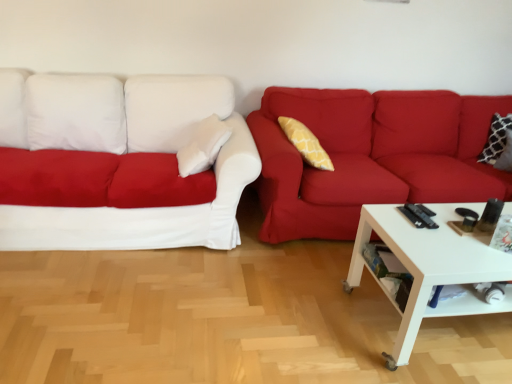
At what (x,y) coordinates should I click in order to perform the action: click on matte red couch at right, which is counted as the second studio couch, starting from the left. Please return your answer as a coordinate pair (x, y). The height and width of the screenshot is (384, 512). Looking at the image, I should click on (371, 156).

Where is `white glossy coffee table at lower right`? This screenshot has width=512, height=384. white glossy coffee table at lower right is located at coordinates (430, 267).

Locate an element on the screen. This screenshot has width=512, height=384. white fabric couch at left, placed as the 2th studio couch when sorted from right to left is located at coordinates (120, 162).

Considering the positions of point (501, 186) and point (257, 154), is point (501, 186) closer or farther from the camera than point (257, 154)?

Point (501, 186) appears to be farther away from the viewer than point (257, 154).

Is matte red couch at right, which is counted as the second studio couch, starting from the left, positioned in front of white fabric couch at left, placed as the 2th studio couch when sorted from right to left?

No, it is behind white fabric couch at left, placed as the 2th studio couch when sorted from right to left.

Based on the photo, from a real-world perspective, who is located lower, matte red couch at right, which is counted as the second studio couch, starting from the left, or white fabric couch at left, the first studio couch when ordered from left to right?

matte red couch at right, which is counted as the second studio couch, starting from the left.

Is matte red couch at right, placed as the 1th studio couch when sorted from right to left, at the left side of white fabric couch at left, placed as the 2th studio couch when sorted from right to left?

No, matte red couch at right, placed as the 1th studio couch when sorted from right to left, is not to the left of white fabric couch at left, placed as the 2th studio couch when sorted from right to left.

From a real-world perspective, which object rests below the other?

white glossy coffee table at lower right is physically lower.

From the image's perspective, would you say white glossy coffee table at lower right is positioned over white fabric couch at left, placed as the 2th studio couch when sorted from right to left?

Actually, white glossy coffee table at lower right appears below white fabric couch at left, placed as the 2th studio couch when sorted from right to left, in the image.

In order to click on coffee table lying below the white fabric couch at left, the first studio couch when ordered from left to right (from the image's perspective) in this screenshot , I will do `click(430, 267)`.

From the picture: Considering the relative sizes of white glossy coffee table at lower right and white fabric couch at left, the first studio couch when ordered from left to right, in the image provided, is white glossy coffee table at lower right wider than white fabric couch at left, the first studio couch when ordered from left to right,?

Correct, the width of white glossy coffee table at lower right exceeds that of white fabric couch at left, the first studio couch when ordered from left to right.

Between white fabric couch at left, the first studio couch when ordered from left to right, and matte red couch at right, which is counted as the second studio couch, starting from the left, which one is positioned in front?

white fabric couch at left, the first studio couch when ordered from left to right.

From a real-world perspective, between white fabric couch at left, placed as the 2th studio couch when sorted from right to left, and matte red couch at right, placed as the 1th studio couch when sorted from right to left, who is vertically higher?

white fabric couch at left, placed as the 2th studio couch when sorted from right to left.

From the image's perspective, which is below, white fabric couch at left, the first studio couch when ordered from left to right, or matte red couch at right, which is counted as the second studio couch, starting from the left?

matte red couch at right, which is counted as the second studio couch, starting from the left, appears lower in the image.

In terms of height, does white fabric couch at left, placed as the 2th studio couch when sorted from right to left, look taller or shorter compared to matte red couch at right, which is counted as the second studio couch, starting from the left?

Clearly, white fabric couch at left, placed as the 2th studio couch when sorted from right to left, is taller compared to matte red couch at right, which is counted as the second studio couch, starting from the left.

From a real-world perspective, which is physically below, white glossy coffee table at lower right or matte red couch at right, placed as the 1th studio couch when sorted from right to left?

white glossy coffee table at lower right is physically lower.

Is white glossy coffee table at lower right located outside matte red couch at right, placed as the 1th studio couch when sorted from right to left?

Indeed, white glossy coffee table at lower right is completely outside matte red couch at right, placed as the 1th studio couch when sorted from right to left.

The image size is (512, 384). What are the coordinates of `the 1st studio couch to the left of the white glossy coffee table at lower right, counting from the anchor's position` in the screenshot? It's located at (371, 156).

In terms of height, does white glossy coffee table at lower right look taller or shorter compared to matte red couch at right, which is counted as the second studio couch, starting from the left?

In the image, white glossy coffee table at lower right appears to be shorter than matte red couch at right, which is counted as the second studio couch, starting from the left.

Is there a large distance between white fabric couch at left, the first studio couch when ordered from left to right, and white glossy coffee table at lower right?

Yes.

From a real-world perspective, who is located higher, white fabric couch at left, the first studio couch when ordered from left to right, or white glossy coffee table at lower right?

white fabric couch at left, the first studio couch when ordered from left to right, is physically above.

Is the depth of white fabric couch at left, placed as the 2th studio couch when sorted from right to left, less than that of white glossy coffee table at lower right?

No, white fabric couch at left, placed as the 2th studio couch when sorted from right to left, is further to the viewer.

What are the coordinates of `the 2nd studio couch directly above the white glossy coffee table at lower right (from a real-world perspective)` in the screenshot? It's located at (120, 162).

From a real-world perspective, is matte red couch at right, which is counted as the second studio couch, starting from the left, physically located above or below white glossy coffee table at lower right?

Clearly, from a real-world perspective, matte red couch at right, which is counted as the second studio couch, starting from the left, is above white glossy coffee table at lower right.

Is there a large distance between matte red couch at right, which is counted as the second studio couch, starting from the left, and white glossy coffee table at lower right?

No, matte red couch at right, which is counted as the second studio couch, starting from the left, is not far away from white glossy coffee table at lower right.

Is matte red couch at right, placed as the 1th studio couch when sorted from right to left, outside of white glossy coffee table at lower right?

matte red couch at right, placed as the 1th studio couch when sorted from right to left, lies outside white glossy coffee table at lower right's area.

Is point (333, 124) behind point (416, 285)?

Yes, point (333, 124) is farther from viewer.

At what (x,y) coordinates should I click in order to perform the action: click on studio couch behind the white fabric couch at left, the first studio couch when ordered from left to right. Please return your answer as a coordinate pair (x, y). The image size is (512, 384). Looking at the image, I should click on (371, 156).

At what (x,y) coordinates should I click in order to perform the action: click on coffee table on the right side of white fabric couch at left, the first studio couch when ordered from left to right. Please return your answer as a coordinate pair (x, y). Looking at the image, I should click on (430, 267).

Estimate the real-world distances between objects in this image. Which object is further from white glossy coffee table at lower right, matte red couch at right, which is counted as the second studio couch, starting from the left, or white fabric couch at left, the first studio couch when ordered from left to right?

white fabric couch at left, the first studio couch when ordered from left to right.

Estimate the real-world distances between objects in this image. Which object is closer to white fabric couch at left, the first studio couch when ordered from left to right, matte red couch at right, which is counted as the second studio couch, starting from the left, or white glossy coffee table at lower right?

The object closer to white fabric couch at left, the first studio couch when ordered from left to right, is matte red couch at right, which is counted as the second studio couch, starting from the left.

Which object lies nearer to the anchor point white glossy coffee table at lower right, white fabric couch at left, the first studio couch when ordered from left to right, or matte red couch at right, placed as the 1th studio couch when sorted from right to left?

matte red couch at right, placed as the 1th studio couch when sorted from right to left, is positioned closer to the anchor white glossy coffee table at lower right.

Looking at this image, when comparing their distances from white fabric couch at left, the first studio couch when ordered from left to right, does white glossy coffee table at lower right or matte red couch at right, which is counted as the second studio couch, starting from the left, seem further?

Among the two, white glossy coffee table at lower right is located further to white fabric couch at left, the first studio couch when ordered from left to right.

Considering their positions, is white glossy coffee table at lower right positioned closer to matte red couch at right, placed as the 1th studio couch when sorted from right to left, than white fabric couch at left, placed as the 2th studio couch when sorted from right to left?

white glossy coffee table at lower right.

Estimate the real-world distances between objects in this image. Which object is closer to matte red couch at right, placed as the 1th studio couch when sorted from right to left, white fabric couch at left, placed as the 2th studio couch when sorted from right to left, or white glossy coffee table at lower right?

The object closer to matte red couch at right, placed as the 1th studio couch when sorted from right to left, is white glossy coffee table at lower right.

Where is `studio couch between white fabric couch at left, the first studio couch when ordered from left to right, and white glossy coffee table at lower right`? The height and width of the screenshot is (384, 512). studio couch between white fabric couch at left, the first studio couch when ordered from left to right, and white glossy coffee table at lower right is located at coordinates (371, 156).